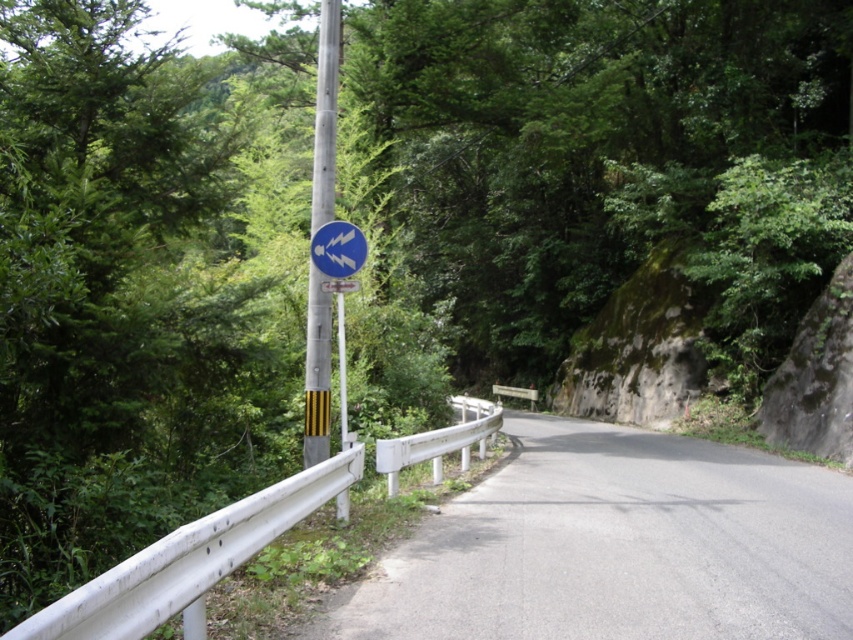
Who is positioned more to the right, gray asphalt road at center or metallic pole at center?

Positioned to the right is gray asphalt road at center.

Is gray asphalt road at center below metallic pole at center?

Indeed, gray asphalt road at center is positioned under metallic pole at center.

Where is `gray asphalt road at center`? Image resolution: width=853 pixels, height=640 pixels. gray asphalt road at center is located at coordinates (618, 547).

Can you confirm if gray asphalt road at center is positioned below blue glossy sign at upper center?

Correct, gray asphalt road at center is located below blue glossy sign at upper center.

Which of these two, gray asphalt road at center or blue glossy sign at upper center, stands taller?

With more height is blue glossy sign at upper center.

Which is behind, point (573, 608) or point (315, 230)?

The point (315, 230) is more distant.

The width and height of the screenshot is (853, 640). In order to click on gray asphalt road at center in this screenshot , I will do `click(618, 547)`.

From the picture: Who is higher up, metallic pole at center or blue glossy sign at upper center?

blue glossy sign at upper center is above.

Who is lower down, metallic pole at center or blue glossy sign at upper center?

Positioned lower is metallic pole at center.

Describe the element at coordinates (325, 115) in the screenshot. This screenshot has height=640, width=853. I see `metallic pole at center` at that location.

Locate an element on the screen. The width and height of the screenshot is (853, 640). metallic pole at center is located at coordinates (325, 115).